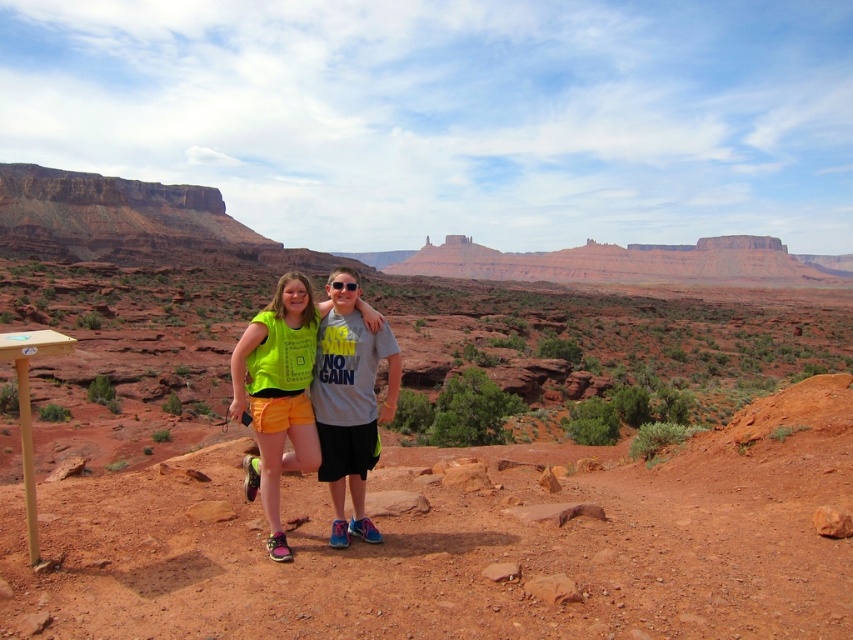
Question: Which point is closer to the camera?

Choices:
 (A) (335, 280)
 (B) (297, 353)
 (C) (345, 336)

Answer: (B)

Question: Which object is closer to the camera taking this photo?

Choices:
 (A) glossy plastic goggles at center
 (B) neon yellow fabric at center

Answer: (B)

Question: Which point is farther to the camera?

Choices:
 (A) (364, 445)
 (B) (247, 465)

Answer: (B)

Question: Is matte gray t-shirt at center positioned behind glossy plastic goggles at center?

Choices:
 (A) yes
 (B) no

Answer: (B)

Question: In this image, where is matte gray t-shirt at center located relative to glossy plastic goggles at center?

Choices:
 (A) right
 (B) left

Answer: (A)

Question: Is neon yellow fabric at center above glossy plastic goggles at center?

Choices:
 (A) yes
 (B) no

Answer: (B)